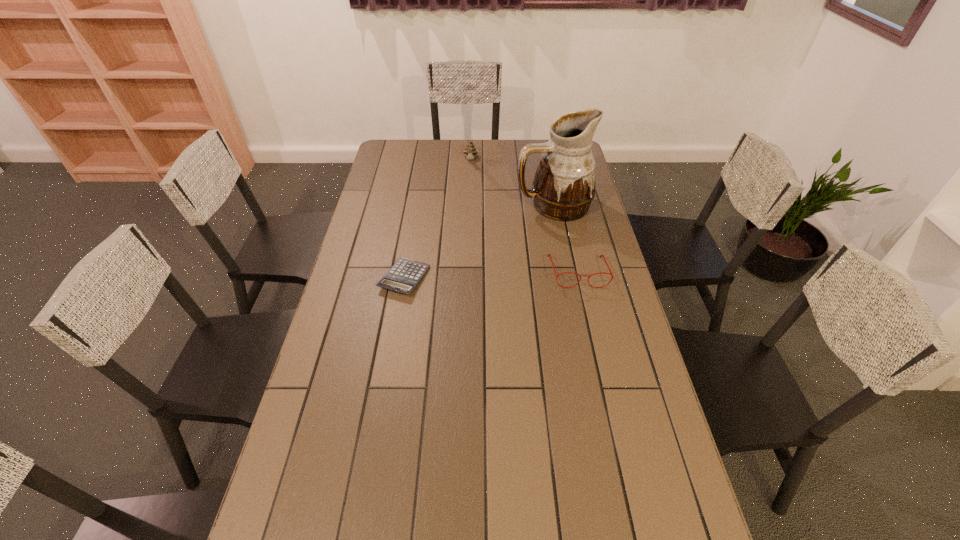
The height and width of the screenshot is (540, 960). Find the location of `empty location between the second object from left to right and the tallest object`. empty location between the second object from left to right and the tallest object is located at coordinates (512, 183).

Image resolution: width=960 pixels, height=540 pixels. I want to click on free area in between the farthest object and the leftmost object, so click(438, 219).

Find the location of a particular element. The image size is (960, 540). vacant space that is in between the spectacles and the tallest object is located at coordinates (565, 239).

Locate an element on the screen. The height and width of the screenshot is (540, 960). unoccupied area between the third shortest object and the tallest object is located at coordinates (512, 183).

Choose which object is the nearest neighbor to the spectacles. Please provide its 2D coordinates. Your answer should be formatted as a tuple, i.e. [(x, y)], where the tuple contains the x and y coordinates of a point satisfying the conditions above.

[(563, 188)]

The image size is (960, 540). Identify the location of object that is the third closest to the third nearest object. (403, 277).

Where is `vacant area in the image that satisfies the following two spatial constraints: 1. on the back side of the leftmost object; 2. on the left side of the second farthest object`? Image resolution: width=960 pixels, height=540 pixels. vacant area in the image that satisfies the following two spatial constraints: 1. on the back side of the leftmost object; 2. on the left side of the second farthest object is located at coordinates (417, 205).